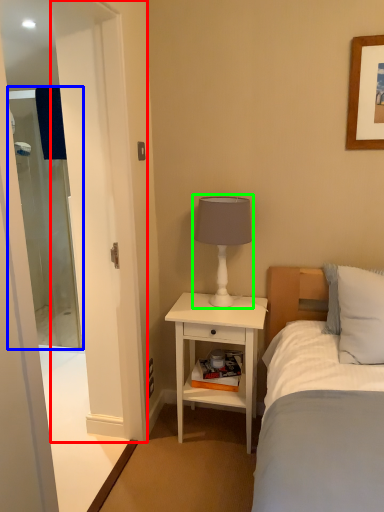
Question: Considering the real-world distances, which object is closest to screen door (highlighted by a red box)? screen door (highlighted by a blue box) or table lamp (highlighted by a green box).

Choices:
 (A) screen door
 (B) table lamp

Answer: (B)